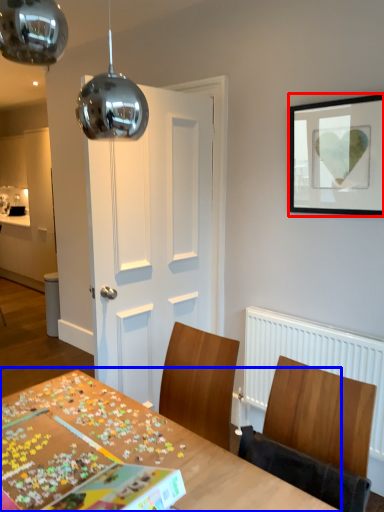
Question: Which object appears farthest to the camera in this image, picture frame (highlighted by a red box) or table (highlighted by a blue box)?

Choices:
 (A) picture frame
 (B) table

Answer: (A)